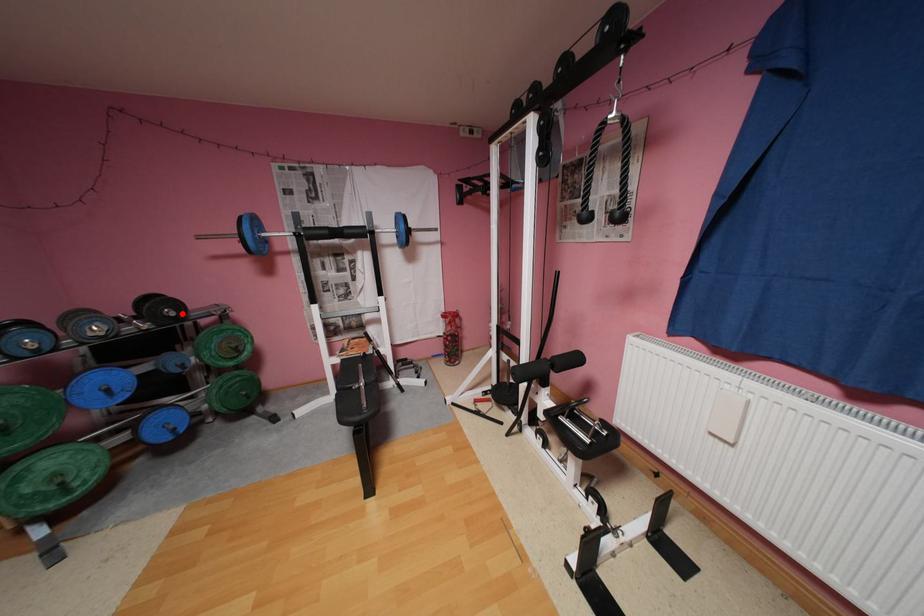
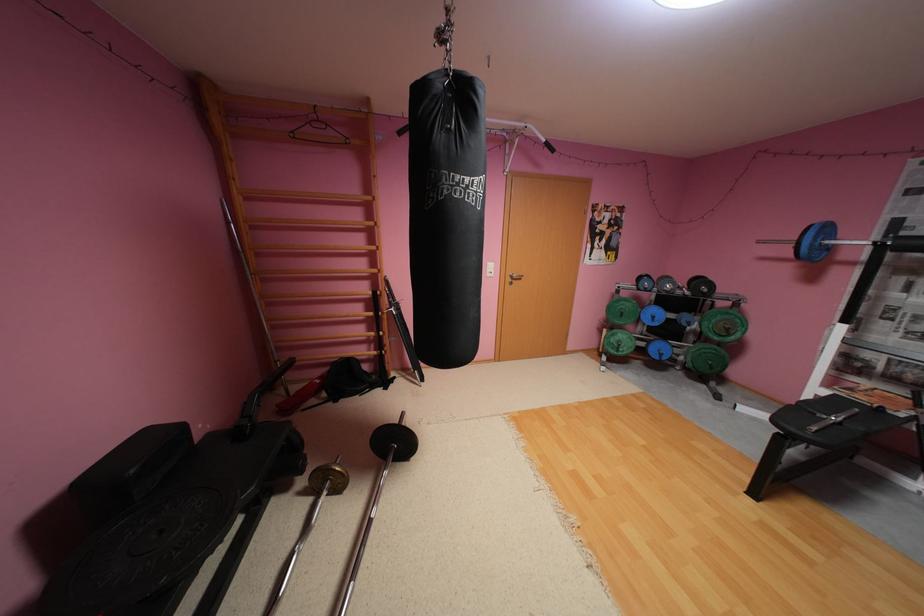
In the second image, find the point that corresponds to the highlighted location in the first image.

(714, 291)